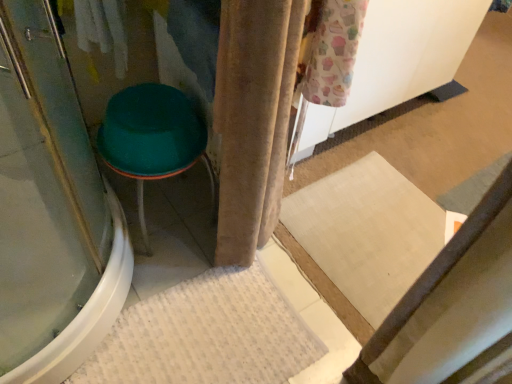
I want to click on free space below white textured bath mat at lower center (from a real-world perspective), so pyautogui.click(x=194, y=332).